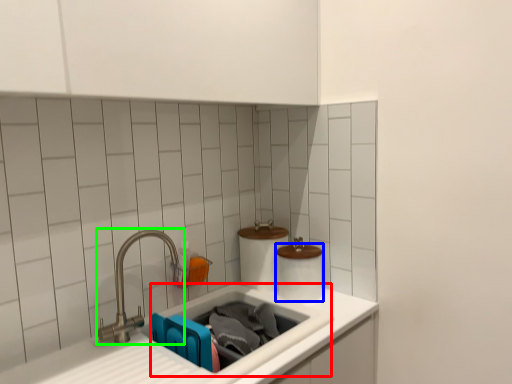
Question: Considering the real-world distances, which object is closest to sink (highlighted by a red box)? toilet paper (highlighted by a blue box) or tap (highlighted by a green box).

Choices:
 (A) toilet paper
 (B) tap

Answer: (A)